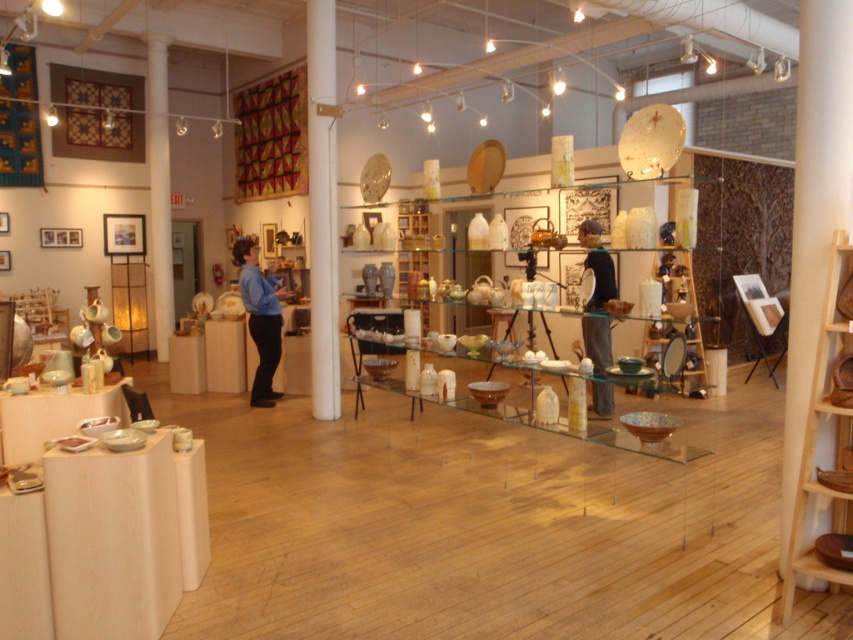
Question: Is transparent glass table at center in front of blue shirt at center?

Choices:
 (A) yes
 (B) no

Answer: (A)

Question: Can you confirm if transparent glass table at center is positioned above blue shirt at center?

Choices:
 (A) no
 (B) yes

Answer: (A)

Question: Based on their relative distances, which object is farther from the black fabric shirt at center?

Choices:
 (A) transparent glass table at center
 (B) blue shirt at center

Answer: (B)

Question: Estimate the real-world distances between objects in this image. Which object is farther from the black fabric shirt at center?

Choices:
 (A) blue shirt at center
 (B) transparent glass table at center

Answer: (A)

Question: Is transparent glass table at center positioned before black fabric shirt at center?

Choices:
 (A) yes
 (B) no

Answer: (A)

Question: Based on their relative distances, which object is nearer to the transparent glass table at center?

Choices:
 (A) black fabric shirt at center
 (B) blue shirt at center

Answer: (A)